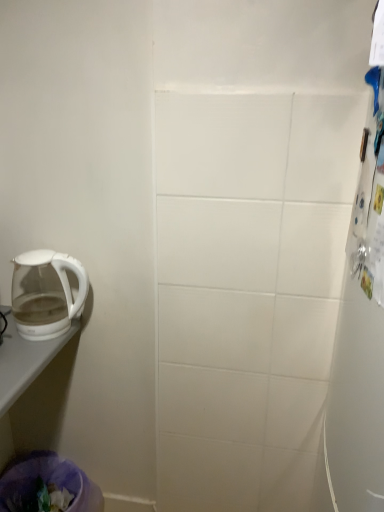
Describe the element at coordinates (46, 293) in the screenshot. I see `transparent glass kettle at left` at that location.

Locate an element on the screen. Image resolution: width=384 pixels, height=512 pixels. transparent glass kettle at left is located at coordinates (46, 293).

Find the location of a particular element. The image size is (384, 512). transparent glass kettle at left is located at coordinates (46, 293).